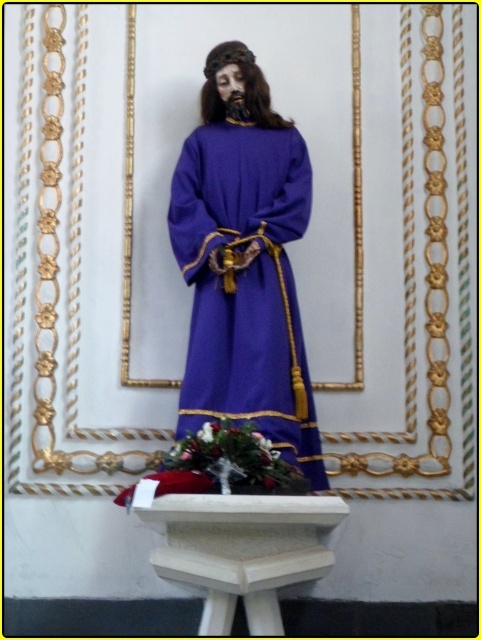
Between point (285, 362) and point (215, 508), which one is positioned in front?

Point (215, 508) is more forward.

Who is positioned more to the left, purple woolen robe at center or white wood altar at center?

purple woolen robe at center is more to the left.

In order to click on purple woolen robe at center in this screenshot , I will do `click(245, 284)`.